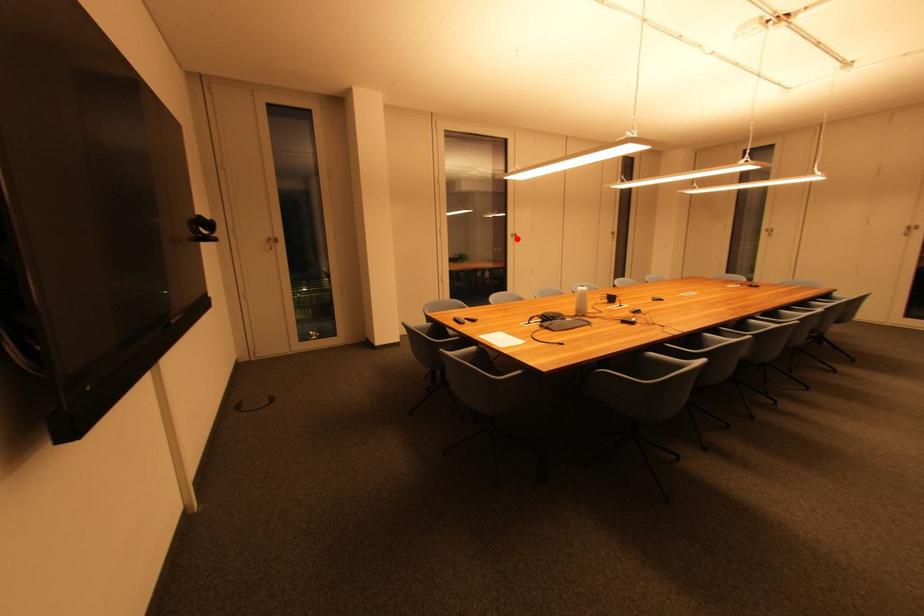
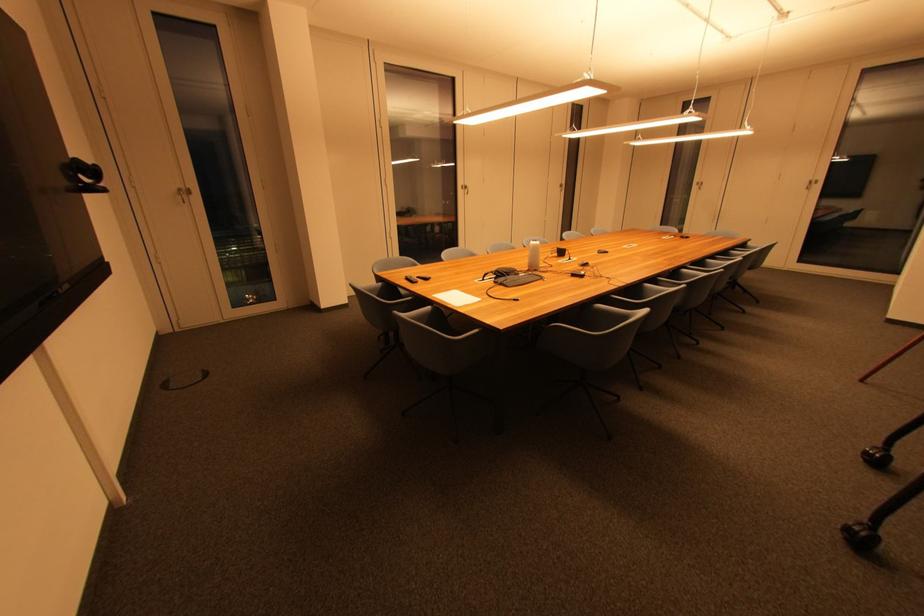
Locate, in the second image, the point that corresponds to the highlighted location in the first image.

(468, 190)